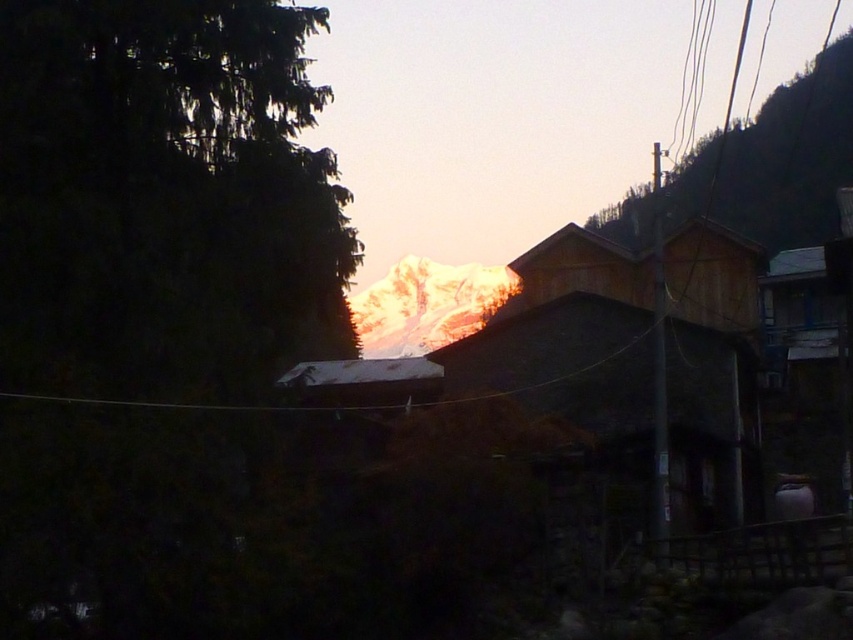
You are a hiker standing at the base of the green matte tree at left and want to reach the green textured hillside at upper right. Which direction should you move to ascend towards the hillside?

The green matte tree at left is below the green textured hillside at upper right, so you should move towards the upper right direction to ascend towards the hillside.